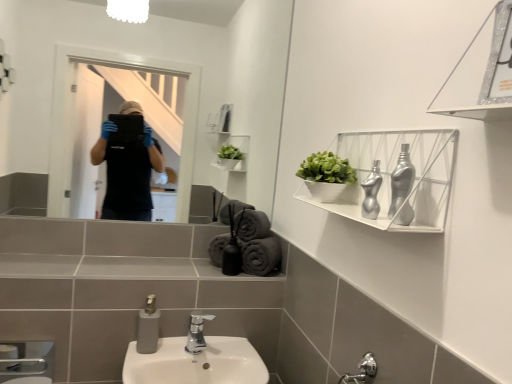
Question: From the image's perspective, is gray cotton towels at lower center, marked as the 1th bath towel in a right-to-left arrangement, located above or below metallic silver shelf at upper right, marked as the 1th shelf in a front-to-back arrangement?

Choices:
 (A) below
 (B) above

Answer: (A)

Question: Looking at their shapes, would you say gray cotton towels at lower center, the 4th bath towel viewed from the left, is wider or thinner than metallic silver shelf at upper right, marked as the 1th shelf in a front-to-back arrangement?

Choices:
 (A) thin
 (B) wide

Answer: (B)

Question: Estimate the real-world distances between objects in this image. Which object is closer to the white matte shelf at upper right, the first shelf viewed from the back?

Choices:
 (A) polished chrome faucet at center
 (B) gray cotton bath towel at center, acting as the first bath towel starting from the left
 (C) gray cotton towels at lower center, the 4th bath towel viewed from the left
 (D) gray matte soap dispenser at lower center
 (E) gray matte bath towel at center, which is the third bath towel from right to left

Answer: (E)

Question: Considering the real-world distances, which object is farthest from the gray cotton bath towel at center, acting as the first bath towel starting from the left?

Choices:
 (A) gray cotton towels at lower center, the 4th bath towel viewed from the left
 (B) gray cotton bath towel at center, the third bath towel viewed from the left
 (C) gray matte bath towel at center, which is the third bath towel from right to left
 (D) white matte shelf at upper right, which is counted as the 2th shelf, starting from the front
 (E) gray matte soap dispenser at lower center

Answer: (D)